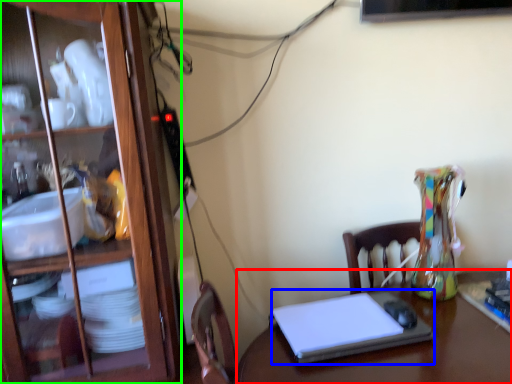
Question: Considering the real-world distances, which object is farthest from desk (highlighted by a red box)? laptop (highlighted by a blue box) or cabinetry (highlighted by a green box)?

Choices:
 (A) laptop
 (B) cabinetry

Answer: (B)